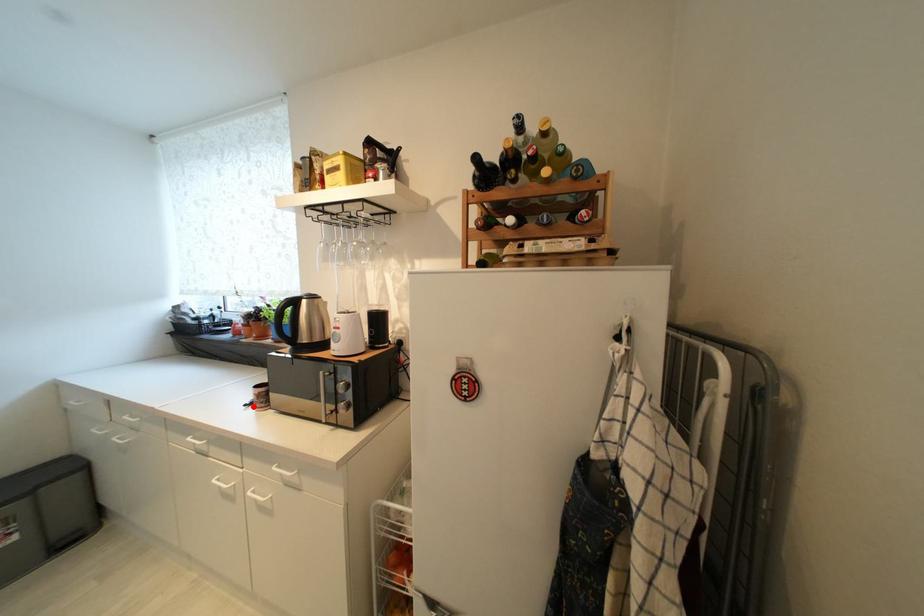
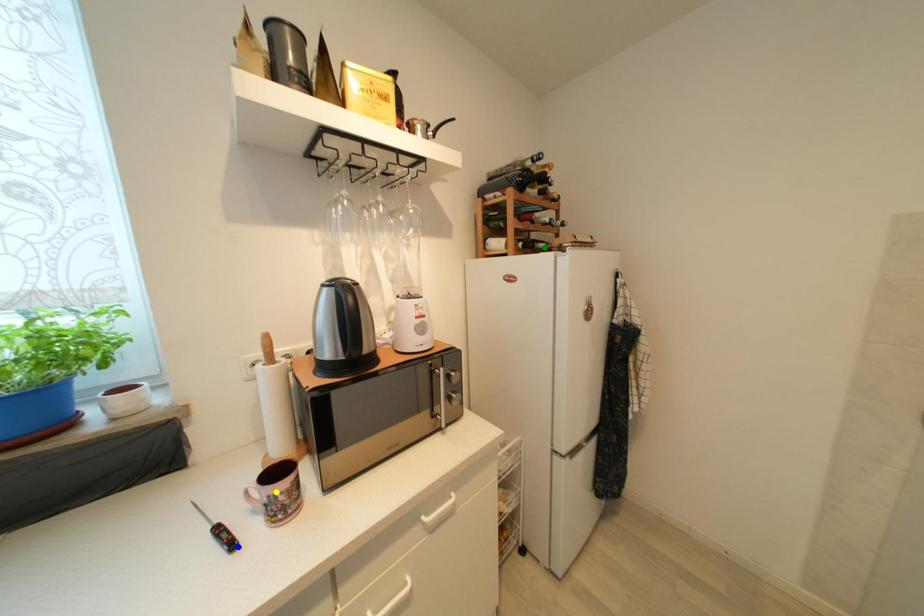
Question: I am providing you with two images of the same scene from different viewpoints. A red point is marked on the first image. You are given multiple points on the second image. Which point in image 2 is actually the same real-world point as the red point in image 1?

Choices:
 (A) blue point
 (B) green point
 (C) yellow point

Answer: (A)